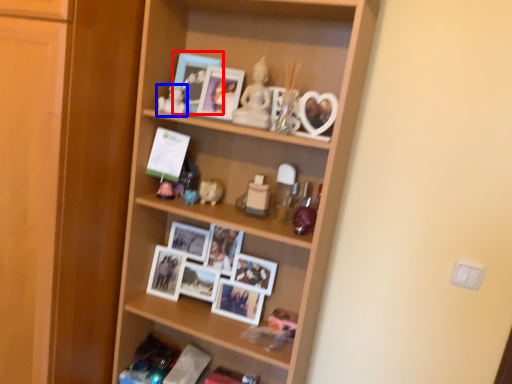
Question: Which object is further to the camera taking this photo, picture frame (highlighted by a red box) or toy (highlighted by a blue box)?

Choices:
 (A) picture frame
 (B) toy

Answer: (A)